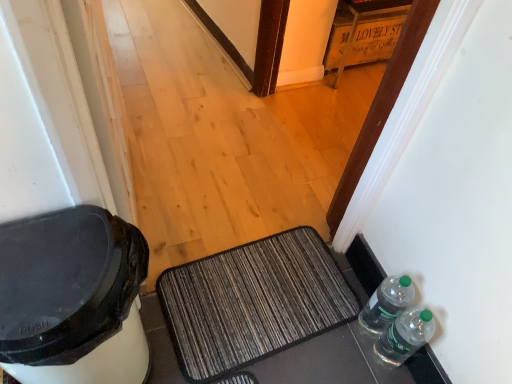
Question: Is wooden crate at upper center positioned with its back to clear plastic bottles at lower right, which is the first bottle in front-to-back order?

Choices:
 (A) no
 (B) yes

Answer: (A)

Question: Can you confirm if wooden crate at upper center is taller than clear plastic bottles at lower right, the second bottle viewed from the back?

Choices:
 (A) no
 (B) yes

Answer: (B)

Question: Does wooden crate at upper center come behind clear plastic bottles at lower right, which is the first bottle in front-to-back order?

Choices:
 (A) no
 (B) yes

Answer: (B)

Question: Considering the relative sizes of wooden crate at upper center and clear plastic bottles at lower right, the second bottle viewed from the back, in the image provided, is wooden crate at upper center bigger than clear plastic bottles at lower right, the second bottle viewed from the back,?

Choices:
 (A) yes
 (B) no

Answer: (A)

Question: Considering the relative sizes of wooden crate at upper center and clear plastic bottles at lower right, the second bottle viewed from the back, in the image provided, is wooden crate at upper center wider than clear plastic bottles at lower right, the second bottle viewed from the back,?

Choices:
 (A) no
 (B) yes

Answer: (B)

Question: In the image, is textured gray doormat at center on the left side or the right side of clear plastic bottles at lower right, which ranks as the first bottle in back-to-front order?

Choices:
 (A) left
 (B) right

Answer: (A)

Question: Is textured gray doormat at center situated inside clear plastic bottles at lower right, which ranks as the first bottle in back-to-front order, or outside?

Choices:
 (A) outside
 (B) inside

Answer: (A)

Question: Considering the positions of textured gray doormat at center and clear plastic bottles at lower right, which ranks as the first bottle in back-to-front order, in the image, is textured gray doormat at center taller or shorter than clear plastic bottles at lower right, which ranks as the first bottle in back-to-front order,?

Choices:
 (A) short
 (B) tall

Answer: (A)

Question: From the image's perspective, is textured gray doormat at center located above or below clear plastic bottles at lower right, which appears as the 2th bottle when viewed from the front?

Choices:
 (A) below
 (B) above

Answer: (A)

Question: Is textured gray doormat at center wider or thinner than wooden crate at upper center?

Choices:
 (A) wide
 (B) thin

Answer: (B)

Question: Is textured gray doormat at center to the left or to the right of wooden crate at upper center in the image?

Choices:
 (A) right
 (B) left

Answer: (B)

Question: From their relative heights in the image, would you say textured gray doormat at center is taller or shorter than wooden crate at upper center?

Choices:
 (A) short
 (B) tall

Answer: (A)

Question: Based on their sizes in the image, would you say textured gray doormat at center is bigger or smaller than wooden crate at upper center?

Choices:
 (A) big
 (B) small

Answer: (B)

Question: From their relative heights in the image, would you say clear plastic bottles at lower right, which appears as the 2th bottle when viewed from the front, is taller or shorter than clear plastic bottles at lower right, which is the first bottle in front-to-back order?

Choices:
 (A) tall
 (B) short

Answer: (A)

Question: Is clear plastic bottles at lower right, which ranks as the first bottle in back-to-front order, in front of or behind clear plastic bottles at lower right, the second bottle viewed from the back, in the image?

Choices:
 (A) front
 (B) behind

Answer: (B)